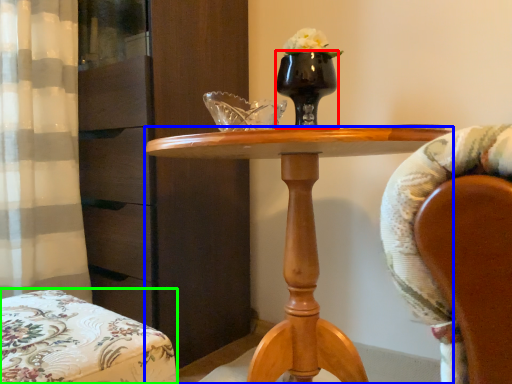
Question: Estimate the real-world distances between objects in this image. Which object is farther from vase (highlighted by a red box), desk (highlighted by a blue box) or chair (highlighted by a green box)?

Choices:
 (A) desk
 (B) chair

Answer: (B)